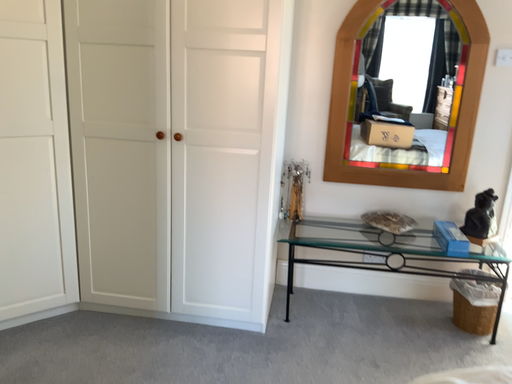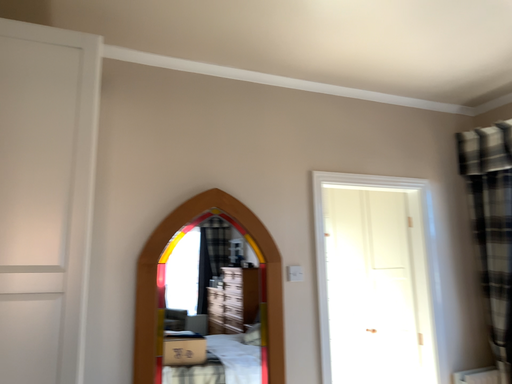
Question: Which way did the camera rotate in the video?

Choices:
 (A) rotated downward
 (B) rotated upward

Answer: (B)